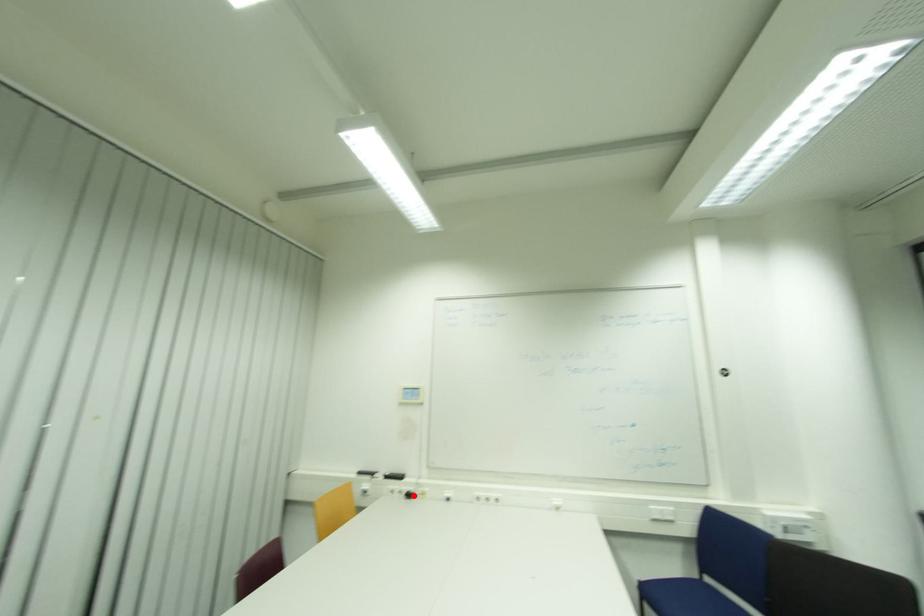
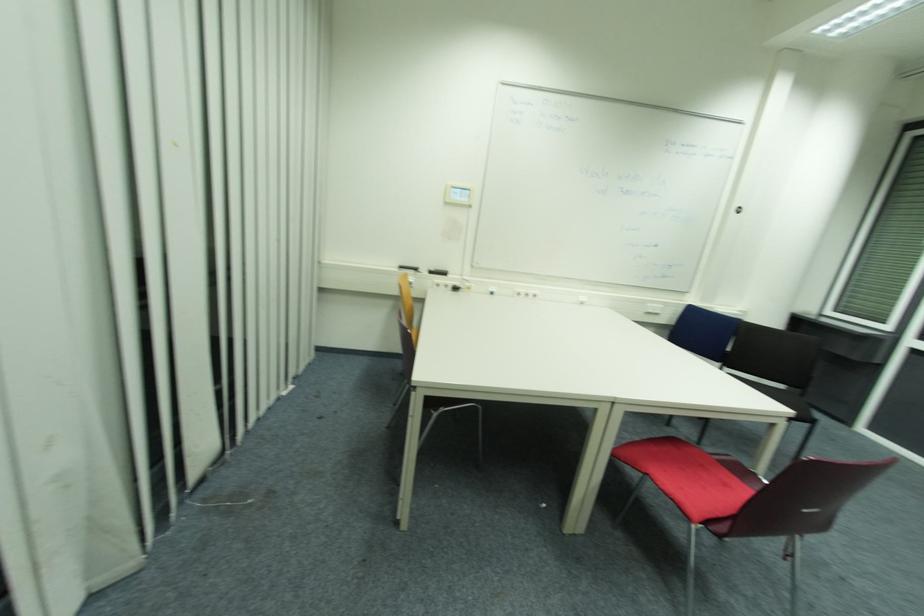
Question: I am providing you with two images of the same scene from different viewpoints. A red point is shown in image1. For the corresponding object point in image2, is it positioned nearer or farther from the camera?

Choices:
 (A) Nearer
 (B) Farther

Answer: (A)